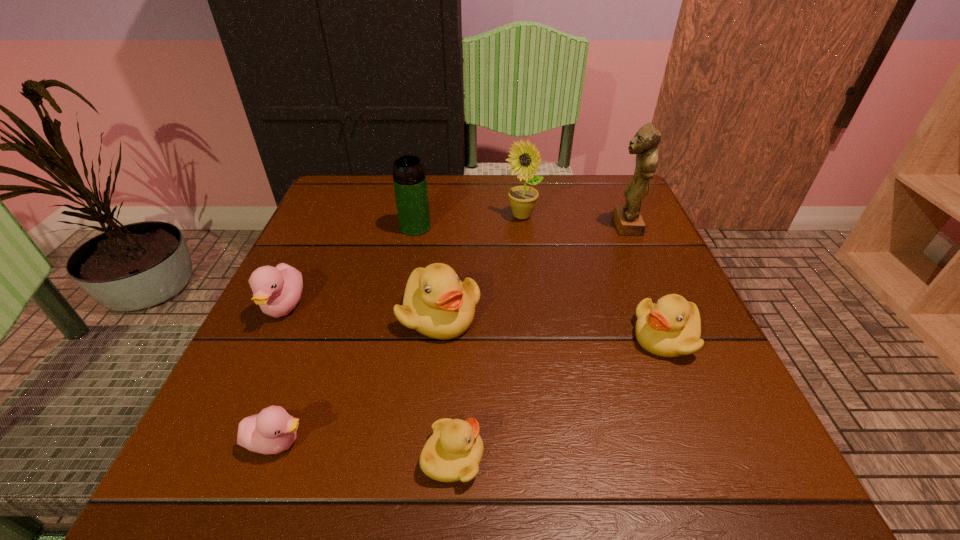
I want to click on the tallest object, so click(x=628, y=220).

Locate an element on the screen. green thermos bottle is located at coordinates (410, 185).

The width and height of the screenshot is (960, 540). Find the location of `yellow sunflower`. yellow sunflower is located at coordinates (525, 158).

At what (x,y) coordinates should I click in order to perform the action: click on sunflower. Please return your answer as a coordinate pair (x, y). Image resolution: width=960 pixels, height=540 pixels. Looking at the image, I should click on (525, 158).

Where is `the biggest yellow duckling`? the biggest yellow duckling is located at coordinates (436, 303).

Find the location of a particular element. The height and width of the screenshot is (540, 960). the bigger pink duckling is located at coordinates (277, 290).

This screenshot has height=540, width=960. Find the location of `the rightmost duckling`. the rightmost duckling is located at coordinates (671, 327).

The height and width of the screenshot is (540, 960). Identify the location of the rightmost yellow duckling. (671, 327).

Find the location of a particular element. This screenshot has width=960, height=540. the smaller pink duckling is located at coordinates (273, 430).

Find the location of `the smallest yellow duckling`. the smallest yellow duckling is located at coordinates (453, 452).